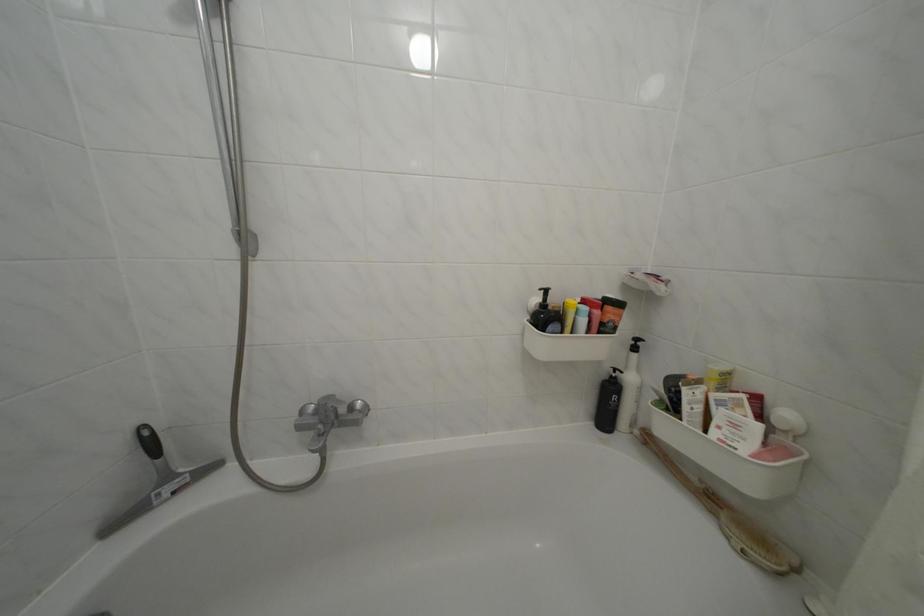
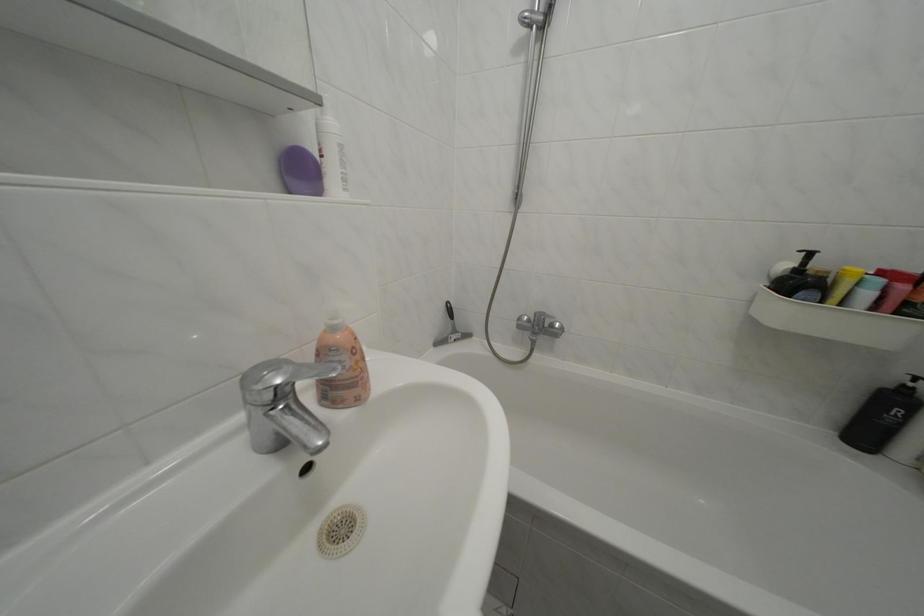
In the second image, find the point that corresponds to [359,414] in the first image.

(562, 331)